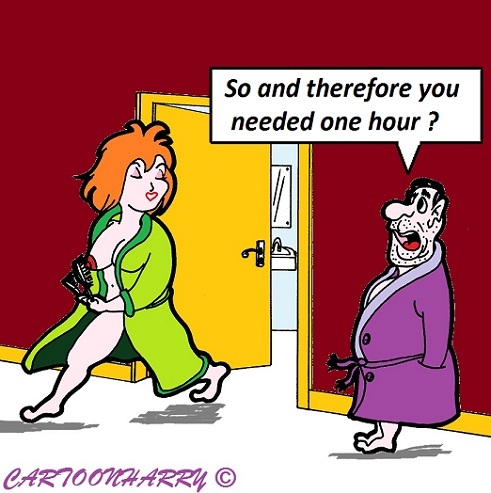
The image size is (491, 493). Find the location of `white floor`. white floor is located at coordinates (273, 444).